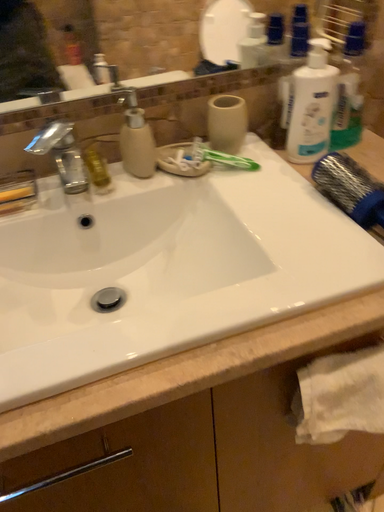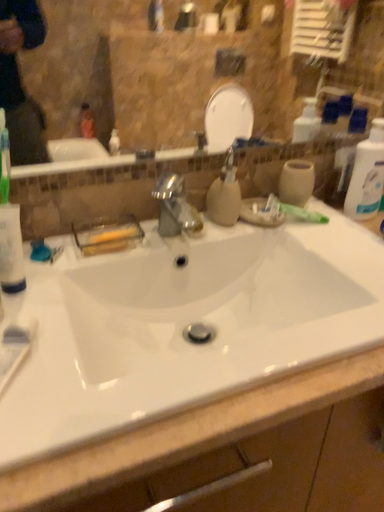
Question: Which way did the camera rotate in the video?

Choices:
 (A) rotated upward
 (B) rotated downward

Answer: (A)